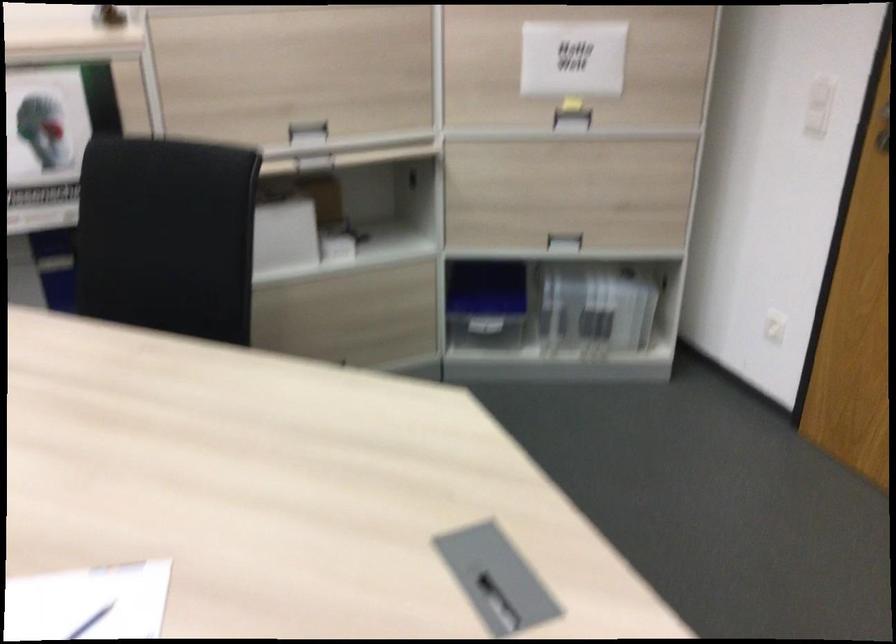
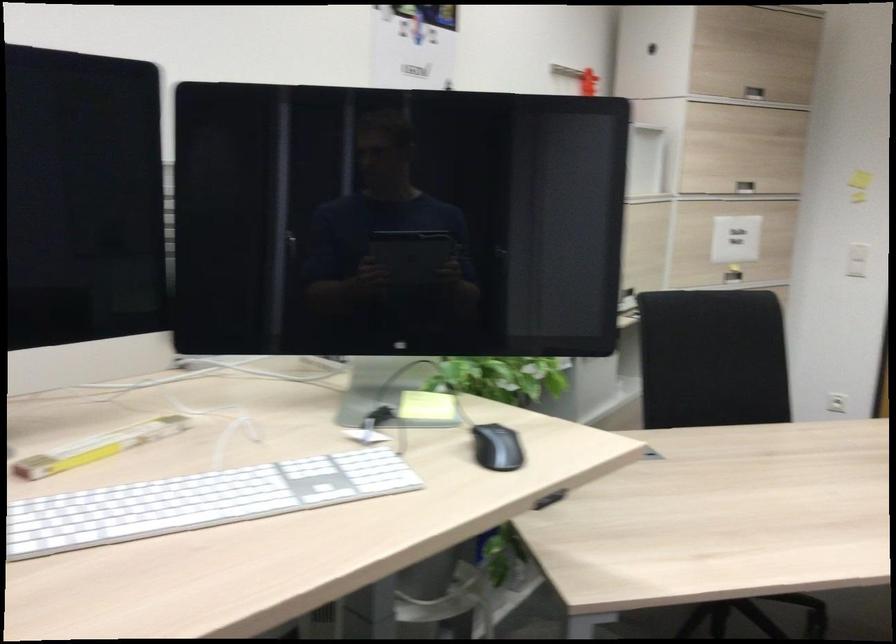
Question: I am providing you with two images of the same scene from different viewpoints. Which of the following objects are not visible in image2?

Choices:
 (A) metal steam wand
 (B) red wall clamp
 (C) yellow folding ruler
 (D) clear plastic container

Answer: (D)